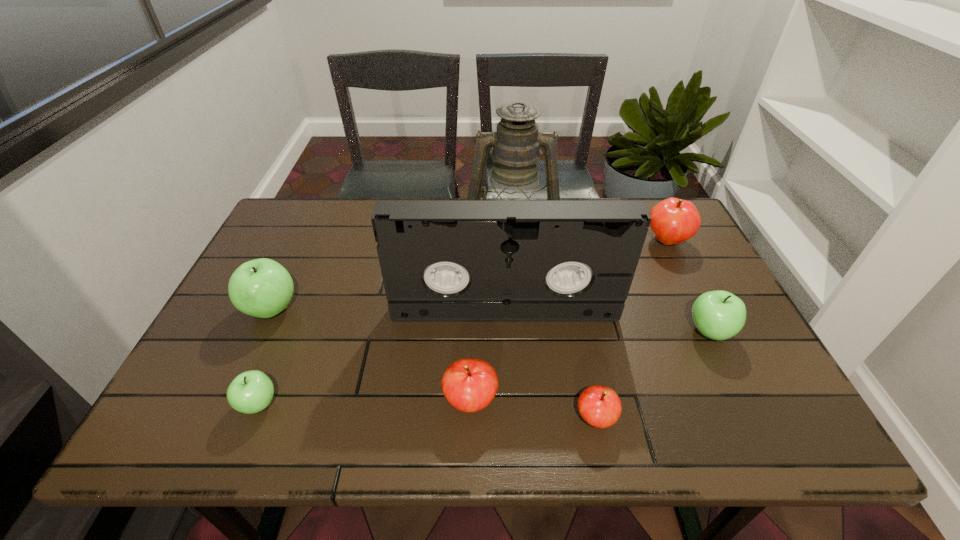
You are a GUI agent. You are given a task and a screenshot of the screen. Output one action in this format:
    pyautogui.click(x=<x>, y=<y>)
    Task: Click on the oil lamp
    The height and width of the screenshot is (540, 960).
    Given the screenshot: What is the action you would take?
    pyautogui.click(x=516, y=145)

In order to click on gray videotape in this screenshot , I will do `click(441, 260)`.

Locate an element on the screen. This screenshot has width=960, height=540. videotape is located at coordinates [441, 260].

The image size is (960, 540). What are the coordinates of `the biggest green apple` in the screenshot? It's located at (262, 288).

In order to click on the rightmost red apple in this screenshot , I will do `click(673, 221)`.

The height and width of the screenshot is (540, 960). Identify the location of the farthest apple. (673, 221).

At what (x,y) coordinates should I click in order to perform the action: click on the rightmost green apple. Please return your answer as a coordinate pair (x, y). Looking at the image, I should click on (719, 315).

The width and height of the screenshot is (960, 540). I want to click on the second smallest red apple, so click(x=469, y=385).

Find the location of a particular element. The width and height of the screenshot is (960, 540). the leftmost red apple is located at coordinates (469, 385).

Locate an element on the screen. the smallest green apple is located at coordinates (250, 392).